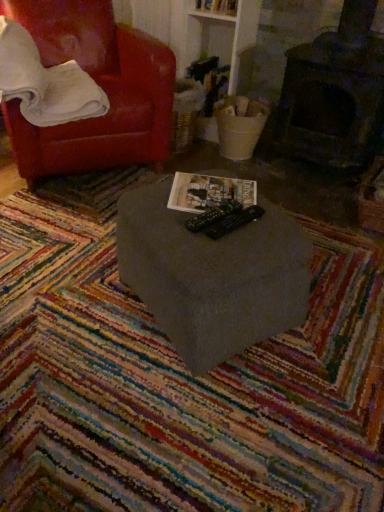
Question: Does matte gray table at center have a larger size compared to multicolored woven mat at center?

Choices:
 (A) yes
 (B) no

Answer: (B)

Question: Does matte gray table at center have a greater width compared to multicolored woven mat at center?

Choices:
 (A) yes
 (B) no

Answer: (B)

Question: Considering the relative sizes of matte gray table at center and multicolored woven mat at center in the image provided, is matte gray table at center taller than multicolored woven mat at center?

Choices:
 (A) yes
 (B) no

Answer: (A)

Question: From the image's perspective, does matte gray table at center appear lower than multicolored woven mat at center?

Choices:
 (A) no
 (B) yes

Answer: (A)

Question: From a real-world perspective, is matte gray table at center positioned under multicolored woven mat at center based on gravity?

Choices:
 (A) yes
 (B) no

Answer: (B)

Question: From the image's perspective, relative to multicolored woven mat at center, is white soft pillow at upper left above or below?

Choices:
 (A) above
 (B) below

Answer: (A)

Question: From their relative heights in the image, would you say white soft pillow at upper left is taller or shorter than multicolored woven mat at center?

Choices:
 (A) tall
 (B) short

Answer: (A)

Question: Considering the positions of white soft pillow at upper left and multicolored woven mat at center in the image, is white soft pillow at upper left wider or thinner than multicolored woven mat at center?

Choices:
 (A) wide
 (B) thin

Answer: (B)

Question: In the image, is white soft pillow at upper left positioned in front of or behind multicolored woven mat at center?

Choices:
 (A) front
 (B) behind

Answer: (B)

Question: Is matte gray table at center wider or thinner than multicolored woven mat at center?

Choices:
 (A) thin
 (B) wide

Answer: (A)

Question: From a real-world perspective, is matte gray table at center physically located above or below multicolored woven mat at center?

Choices:
 (A) above
 (B) below

Answer: (A)

Question: Is matte gray table at center taller or shorter than multicolored woven mat at center?

Choices:
 (A) tall
 (B) short

Answer: (A)

Question: From the image's perspective, is matte gray table at center located above or below multicolored woven mat at center?

Choices:
 (A) above
 (B) below

Answer: (A)

Question: In terms of size, does white soft pillow at upper left appear bigger or smaller than matte paper magazine at center?

Choices:
 (A) small
 (B) big

Answer: (B)

Question: Is point (41, 88) closer or farther from the camera than point (230, 187)?

Choices:
 (A) farther
 (B) closer

Answer: (A)